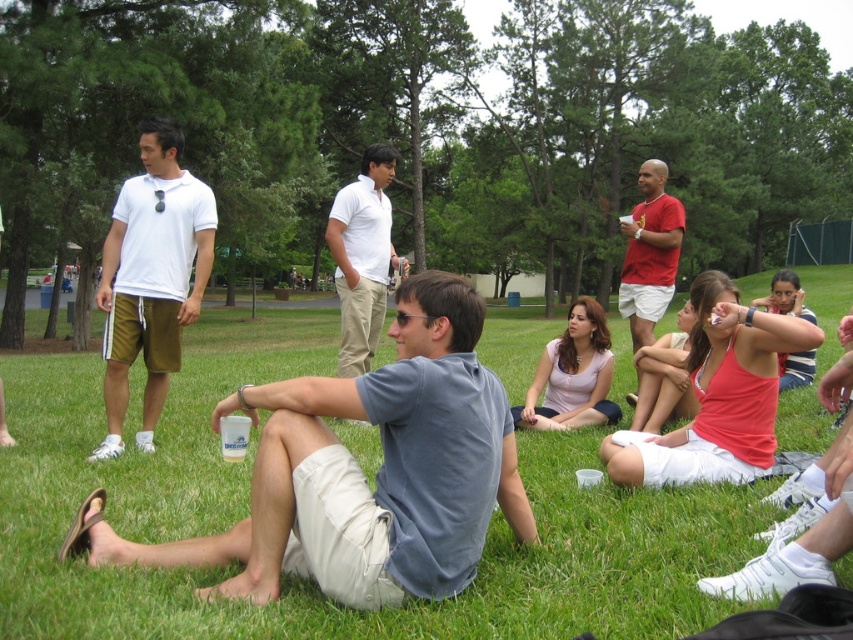
How distant is white cotton polo shirt at left from white cotton shirt at center?

white cotton polo shirt at left is 1.59 meters from white cotton shirt at center.

What do you see at coordinates (151, 276) in the screenshot? This screenshot has width=853, height=640. I see `white cotton polo shirt at left` at bounding box center [151, 276].

Between point (161, 328) and point (347, 228), which one is positioned in front?

Point (161, 328) is more forward.

You are a GUI agent. You are given a task and a screenshot of the screen. Output one action in this format:
    pyautogui.click(x=<x>, y=<y>)
    Task: Click on the white cotton polo shirt at left
    
    Given the screenshot: What is the action you would take?
    pyautogui.click(x=151, y=276)

Does point (409, 481) come closer to viewer compared to point (207, 240)?

Yes, it is in front of point (207, 240).

Who is more forward, (448, 417) or (177, 125)?

Point (448, 417) is more forward.

The image size is (853, 640). Describe the element at coordinates (363, 474) in the screenshot. I see `gray cotton shirt at center` at that location.

I want to click on gray cotton shirt at center, so click(x=363, y=474).

Between gray cotton shirt at center and white cotton shirt at center, which one has more height?

white cotton shirt at center

Between gray cotton shirt at center and white cotton shirt at center, which one is positioned lower?

gray cotton shirt at center

Is point (514, 518) in front of point (352, 358)?

That is True.

Locate an element on the screen. This screenshot has height=640, width=853. gray cotton shirt at center is located at coordinates (363, 474).